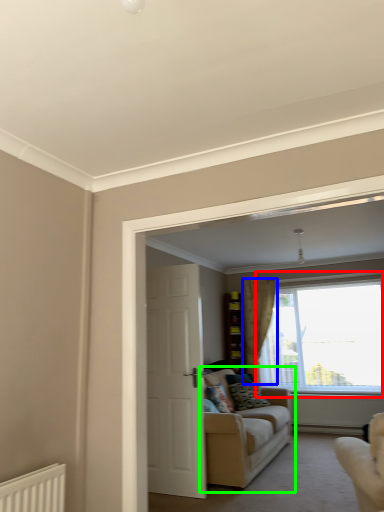
Question: Estimate the real-world distances between objects in this image. Which object is closer to window (highlighted by a red box), curtain (highlighted by a blue box) or studio couch (highlighted by a green box)?

Choices:
 (A) curtain
 (B) studio couch

Answer: (A)